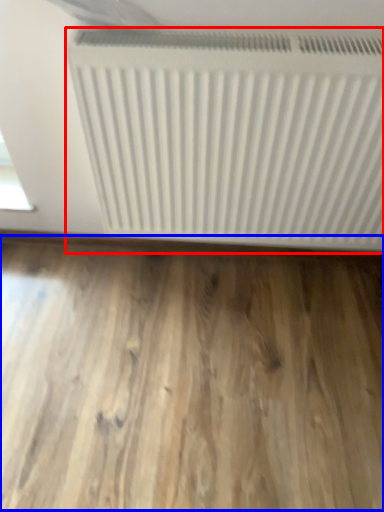
Question: Among these objects, which one is nearest to the camera, radiator (highlighted by a red box) or hardwood (highlighted by a blue box)?

Choices:
 (A) radiator
 (B) hardwood

Answer: (A)